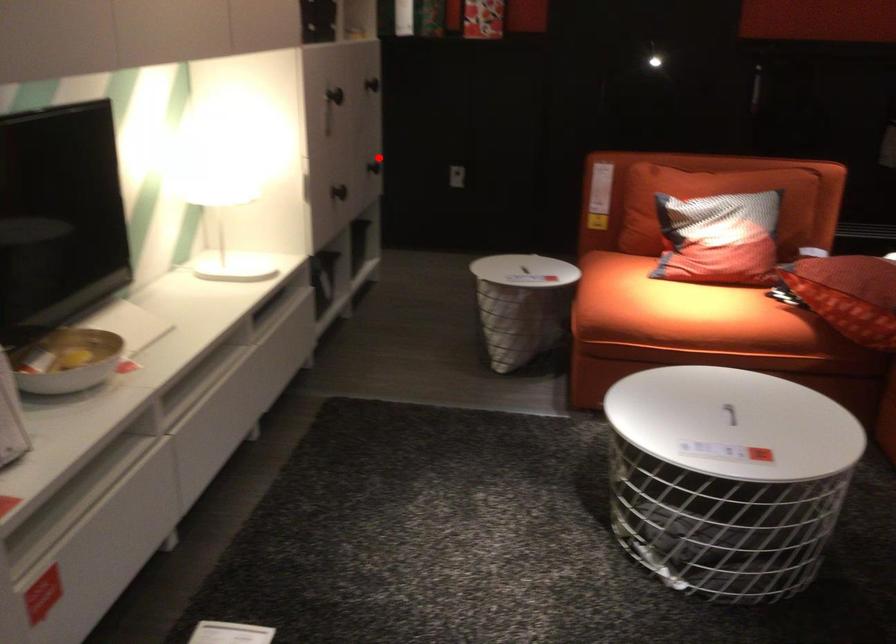
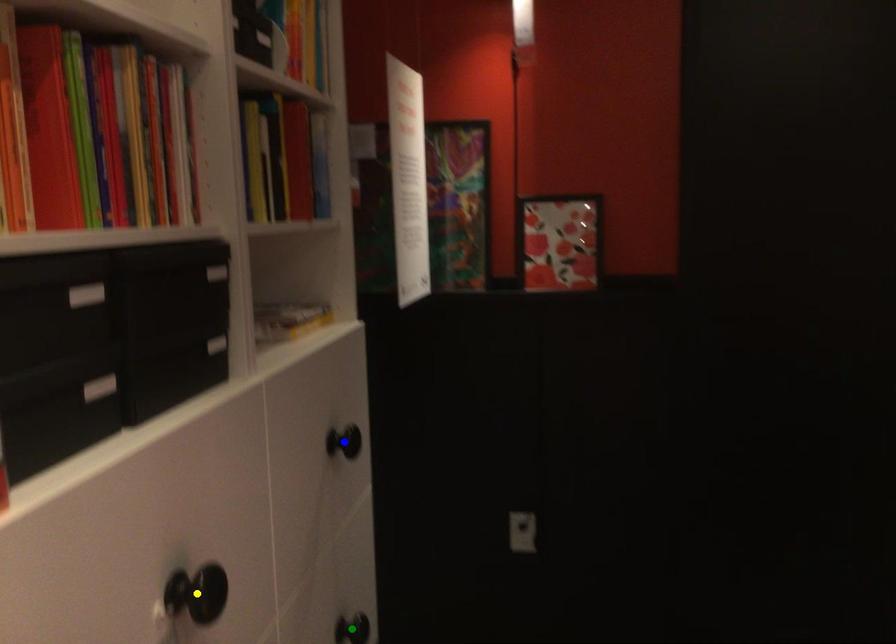
Question: I am providing you with two images of the same scene from different viewpoints. A red point is marked on the first image. You are given multiple points on the second image. In image 2, which mark is for the same physical point as the one in image 1?

Choices:
 (A) blue point
 (B) yellow point
 (C) green point

Answer: (C)